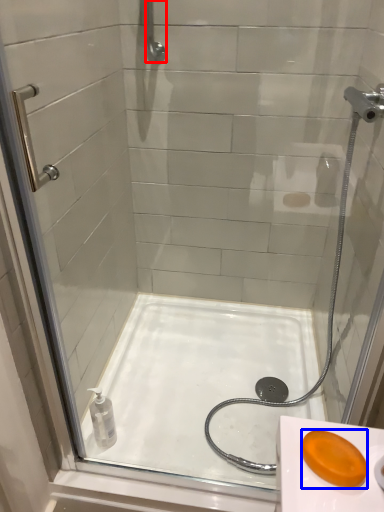
Question: Among these objects, which one is farthest to the camera, shower (highlighted by a red box) or soap (highlighted by a blue box)?

Choices:
 (A) shower
 (B) soap

Answer: (A)